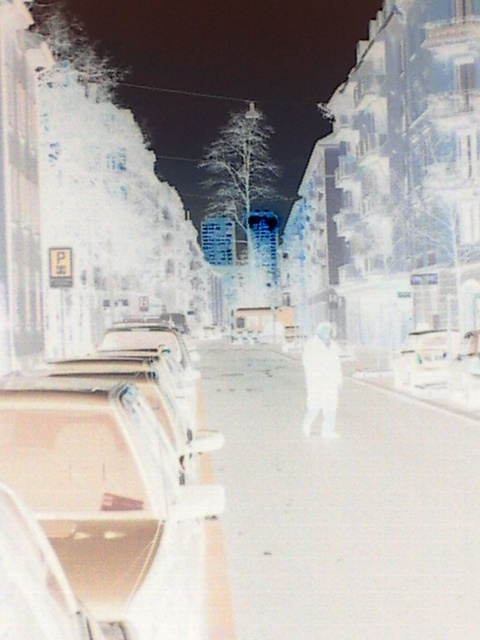
Between metallic gold car at left and white glossy car at center, which one is positioned lower?

white glossy car at center is below.

Between point (87, 524) and point (444, 339), which one is positioned in front?

Point (87, 524) is more forward.

The width and height of the screenshot is (480, 640). Identify the location of metallic gold car at left. (117, 499).

Is point (351, 461) closer to viewer compared to point (407, 355)?

Yes, point (351, 461) is in front of point (407, 355).

Who is higher up, white smooth pavement at center or white glossy car at center?

white glossy car at center is higher up.

Measure the distance between white smooth pavement at center and camera.

white smooth pavement at center is 5.47 meters away from camera.

Find the location of a particular element. white smooth pavement at center is located at coordinates (343, 508).

Which is more to the left, metallic gold car at left or white matte man at center?

Positioned to the left is metallic gold car at left.

Can you confirm if metallic gold car at left is taller than white matte man at center?

Incorrect, metallic gold car at left's height is not larger of white matte man at center's.

Is point (132, 493) closer to camera compared to point (334, 417)?

Yes, point (132, 493) is closer to viewer.

At what (x,y) coordinates should I click in order to perform the action: click on metallic gold car at left. Please return your answer as a coordinate pair (x, y). The image size is (480, 640). Looking at the image, I should click on (117, 499).